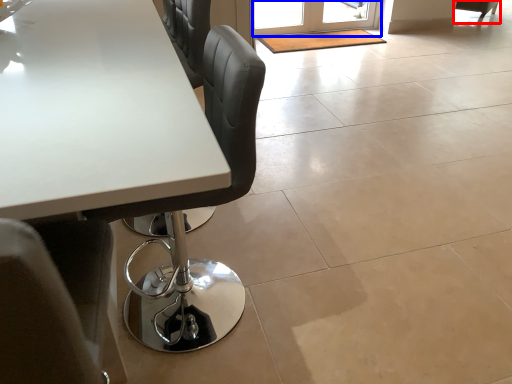
Question: Among these objects, which one is farthest to the camera, chair (highlighted by a red box) or screen door (highlighted by a blue box)?

Choices:
 (A) chair
 (B) screen door

Answer: (A)